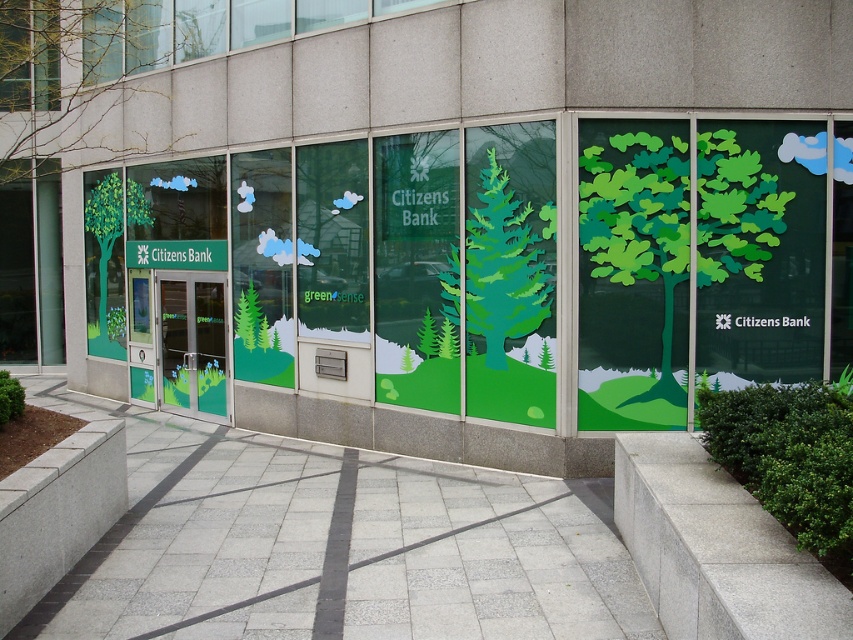
Question: Among these points, which one is farthest from the camera?

Choices:
 (A) (102, 179)
 (B) (167, 392)
 (C) (456, 294)

Answer: (A)

Question: Among these points, which one is nearest to the camera?

Choices:
 (A) (532, 266)
 (B) (97, 204)

Answer: (A)

Question: Can you confirm if green matte tree at upper left is positioned to the left of green matte tree at center?

Choices:
 (A) yes
 (B) no

Answer: (A)

Question: Estimate the real-world distances between objects in this image. Which object is closer to the green matte tree at upper left?

Choices:
 (A) green paper tree at right
 (B) green matte tree at left

Answer: (B)

Question: Does green paper tree at right appear under green matte tree at center?

Choices:
 (A) no
 (B) yes

Answer: (B)

Question: Observing the image, what is the correct spatial positioning of green glass doors at center in reference to green matte tree at left?

Choices:
 (A) below
 (B) above

Answer: (A)